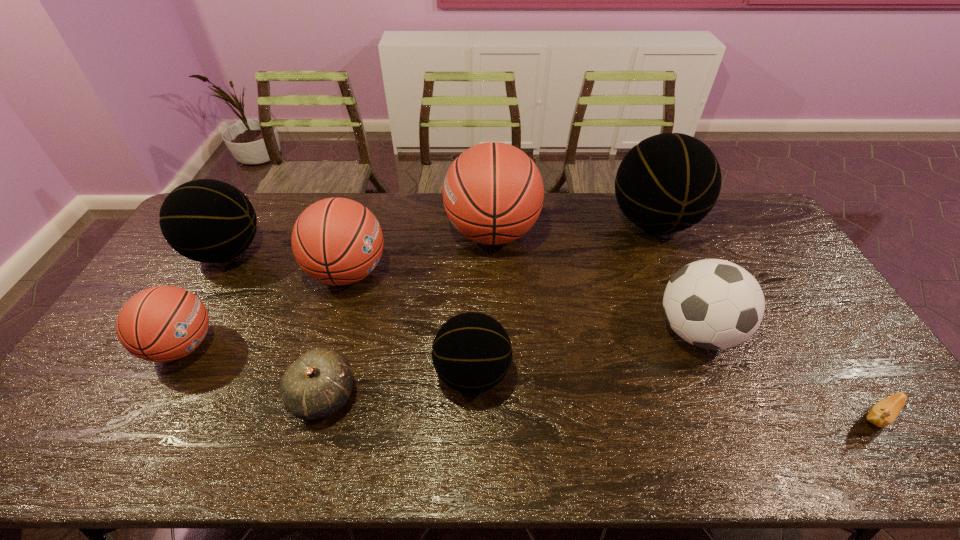
Select which object is the sixth closest to the biggest orange basketball. Please provide its 2D coordinates. Your answer should be formatted as a tuple, i.e. [(x, y)], where the tuple contains the x and y coordinates of a point satisfying the conditions above.

[(205, 220)]

Point out which object is positioned as the nearest to the biggest orange basketball. Please provide its 2D coordinates. Your answer should be formatted as a tuple, i.e. [(x, y)], where the tuple contains the x and y coordinates of a point satisfying the conditions above.

[(337, 241)]

Identify which basketball is the fifth closest to the nearest orange basketball. Please provide its 2D coordinates. Your answer should be formatted as a tuple, i.e. [(x, y)], where the tuple contains the x and y coordinates of a point satisfying the conditions above.

[(668, 182)]

Select which basketball is the third closest to the soccer ball. Please provide its 2D coordinates. Your answer should be formatted as a tuple, i.e. [(x, y)], where the tuple contains the x and y coordinates of a point satisfying the conditions above.

[(471, 353)]

Find the location of a particular element. black basketball that can be found as the third closest to the rightmost orange basketball is located at coordinates (205, 220).

I want to click on black basketball object that ranks as the third closest to the rightmost orange basketball, so click(205, 220).

Identify which orange basketball is the closest to the fourth basketball from right to left. Please provide its 2D coordinates. Your answer should be formatted as a tuple, i.e. [(x, y)], where the tuple contains the x and y coordinates of a point satisfying the conditions above.

[(493, 193)]

Image resolution: width=960 pixels, height=540 pixels. What are the coordinates of `the second closest orange basketball to the banana` in the screenshot? It's located at 337,241.

At what (x,y) coordinates should I click in order to perform the action: click on free space that satisfies the following two spatial constraints: 1. on the logo side of the biggest orange basketball; 2. on the front side of the gourd. Please return your answer as a coordinate pair (x, y). Looking at the image, I should click on (497, 395).

Locate an element on the screen. free region that satisfies the following two spatial constraints: 1. on the logo side of the second shortest object; 2. on the right side of the nearest orange basketball is located at coordinates (155, 395).